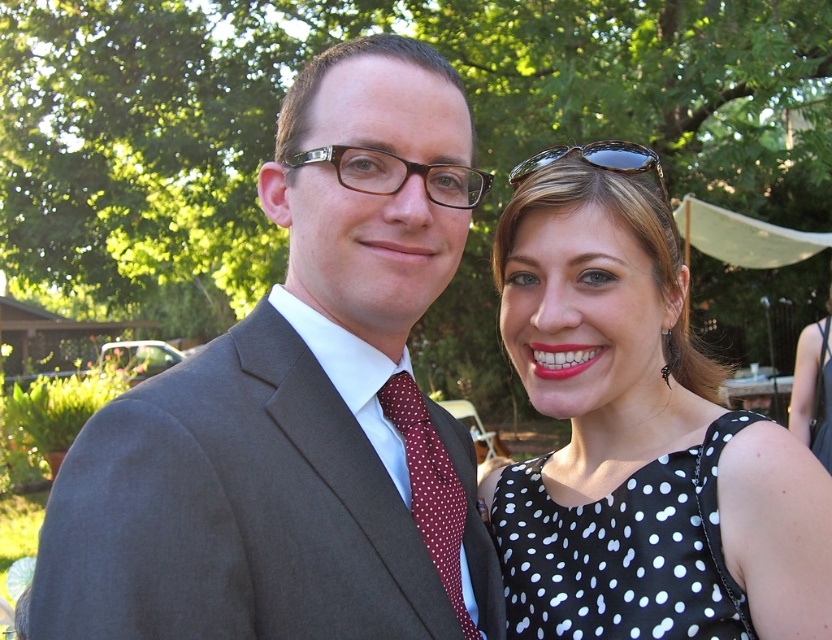
Consider the image. You are standing in the garden and see a point marked at coordinates [429,486]. Which object in the scene does this point belong to?

The point at coordinates [429,486] is on the red dotted fabric tie at center.

You are standing in the image and want to locate the black dotted dress at upper right. Which direction should you look to find it?

The black dotted dress at upper right is located at the coordinates 0.677 on the x axis and 0.767 on the y axis, so you should look towards the upper right direction to find it.